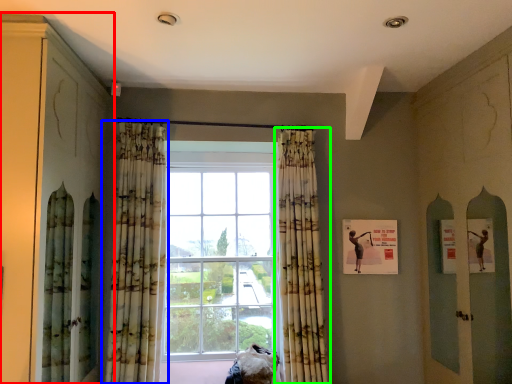
Question: Considering the real-world distances, which object is closest to cabinetry (highlighted by a red box)? curtain (highlighted by a blue box) or curtain (highlighted by a green box).

Choices:
 (A) curtain
 (B) curtain

Answer: (A)